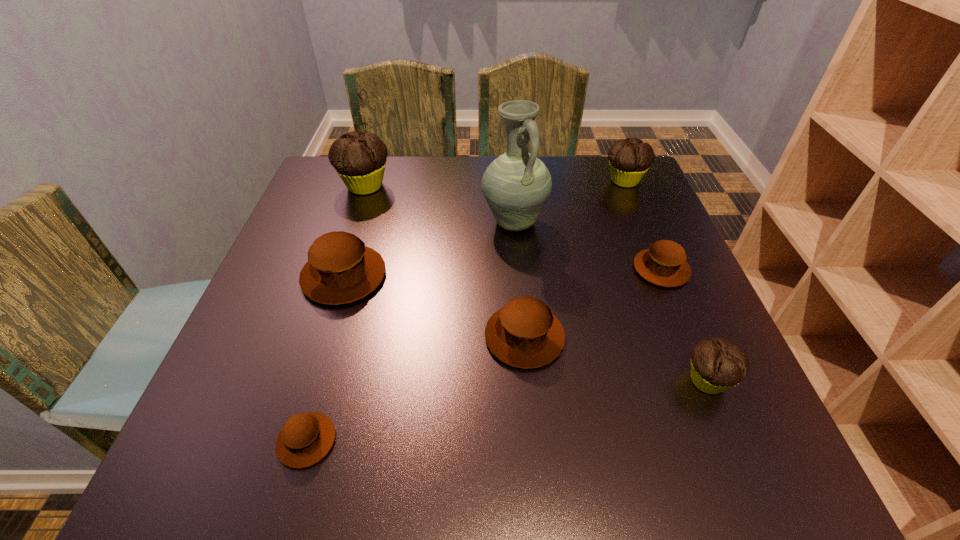
Find the location of a particular element. Image resolution: width=960 pixels, height=540 pixels. free space that is in between the second tallest object and the tallest object is located at coordinates (440, 204).

Find the location of a particular element. unoccupied position between the pitcher and the second smallest brown muffin is located at coordinates (588, 246).

Find the location of a particular element. Image resolution: width=960 pixels, height=540 pixels. blank region between the nearest chocolate muffin and the seventh tallest object is located at coordinates (684, 325).

Locate an element on the screen. Image resolution: width=960 pixels, height=540 pixels. vacant area that lies between the biggest brown muffin and the seventh shortest object is located at coordinates (354, 231).

Find the location of a particular element. free spot between the tallest muffin and the pitcher is located at coordinates (440, 204).

Locate an element on the screen. This screenshot has height=540, width=960. vacant area between the pitcher and the third brown muffin from left to right is located at coordinates (519, 279).

At what (x,y) coordinates should I click in order to perform the action: click on free space that is in between the nearest chocolate muffin and the biggest chocolate muffin. Please return your answer as a coordinate pair (x, y). The height and width of the screenshot is (540, 960). Looking at the image, I should click on (536, 284).

Where is `empty space between the biggest brown muffin and the tallest object`? empty space between the biggest brown muffin and the tallest object is located at coordinates (429, 249).

Find the location of a particular element. The image size is (960, 540). vacant area that lies between the nearest chocolate muffin and the shortest muffin is located at coordinates point(507,410).

Find the location of a particular element. free area in between the nearest object and the nearest chocolate muffin is located at coordinates (507, 410).